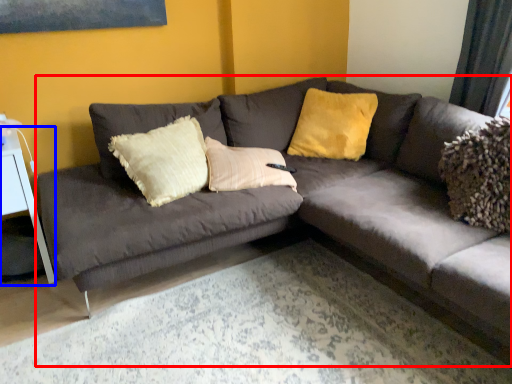
Question: Among these objects, which one is nearest to the camera, studio couch (highlighted by a red box) or table (highlighted by a blue box)?

Choices:
 (A) studio couch
 (B) table

Answer: (A)